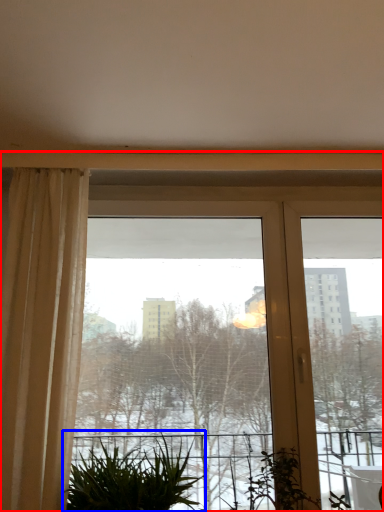
Question: Among these objects, which one is farthest to the camera, window (highlighted by a red box) or houseplant (highlighted by a blue box)?

Choices:
 (A) window
 (B) houseplant

Answer: (A)